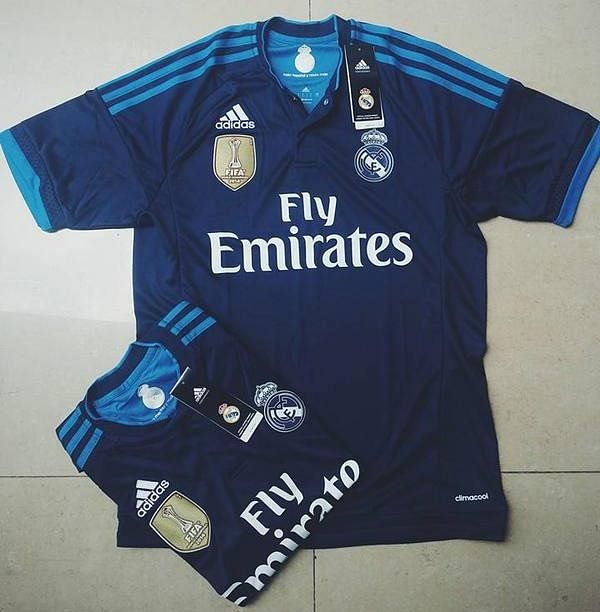
Where is `greyish, white tile background`? This screenshot has height=612, width=600. greyish, white tile background is located at coordinates (528, 422).